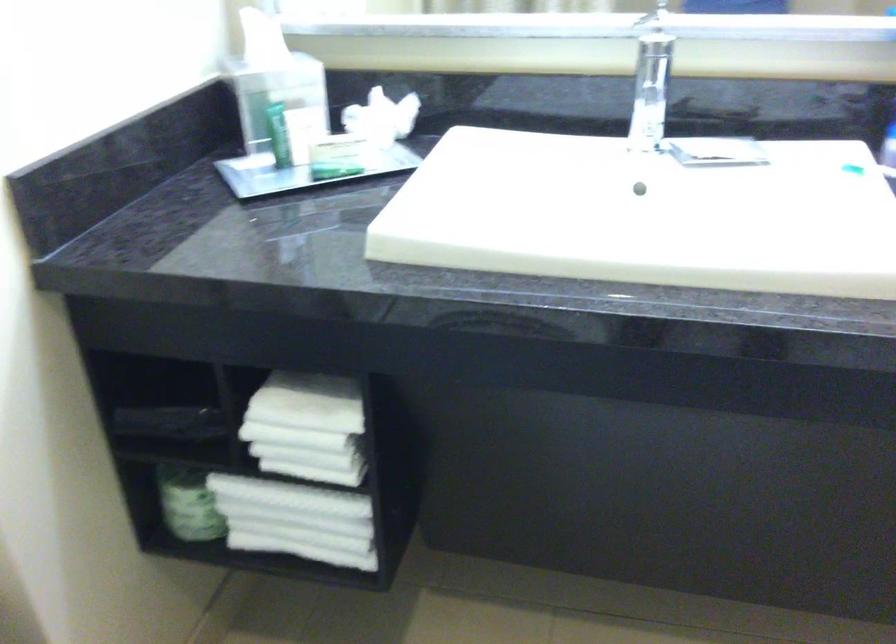
Identify the location of small green tube. The width and height of the screenshot is (896, 644). (279, 134).